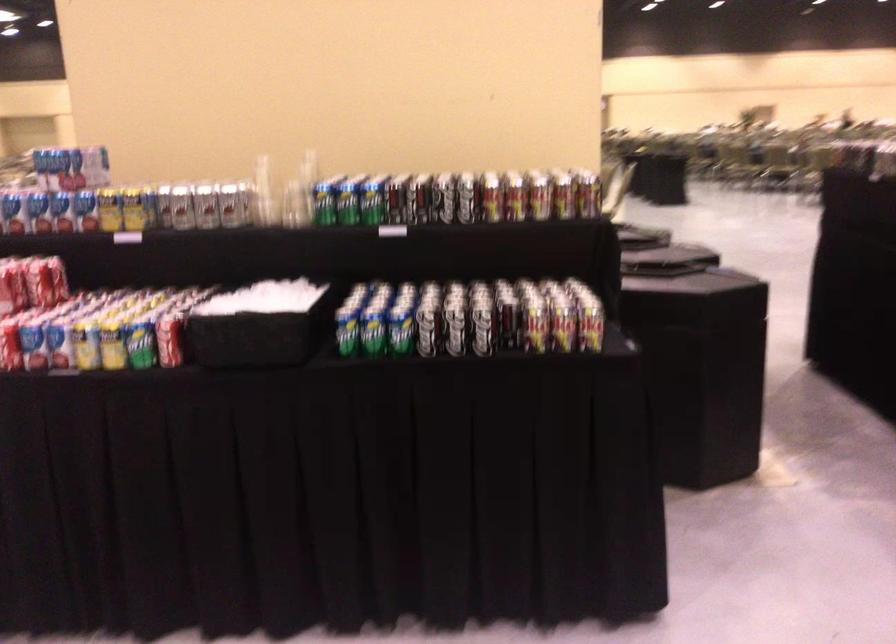
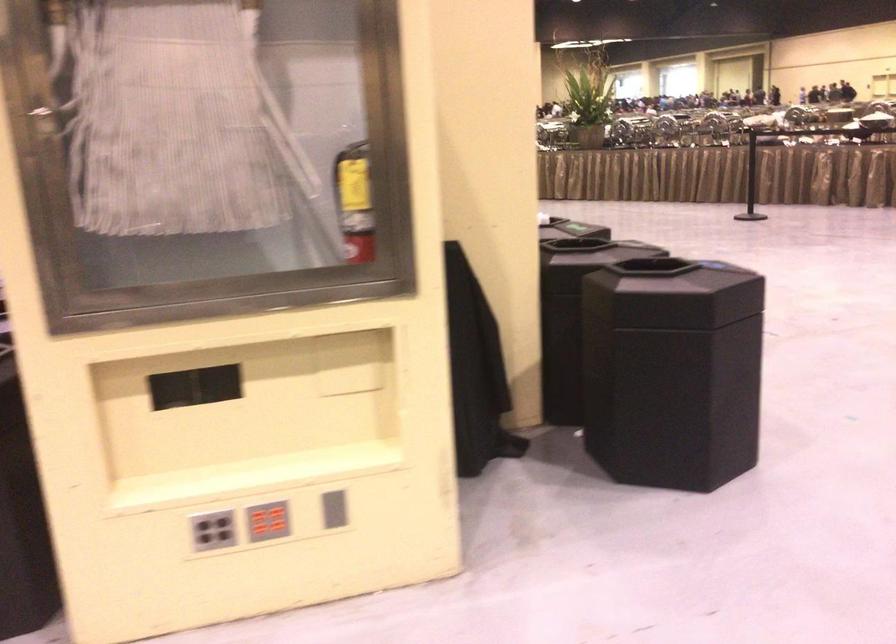
Question: I am providing you with two images of the same scene from different viewpoints. Please identify which objects are invisible in image2.

Choices:
 (A) black trash can lid
 (B) grey button panel
 (C) blue bucket
 (D) silver soda can

Answer: (D)